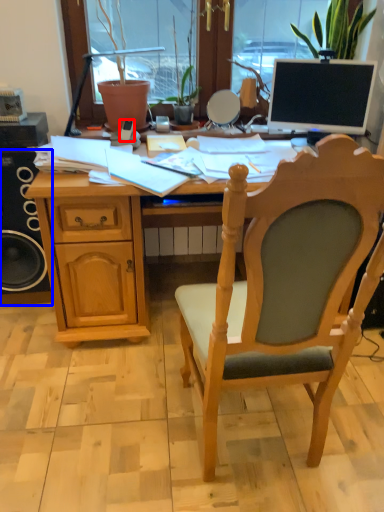
Question: Which object appears closest to the camera in this image, mobile phone (highlighted by a red box) or loudspeaker (highlighted by a blue box)?

Choices:
 (A) mobile phone
 (B) loudspeaker

Answer: (B)